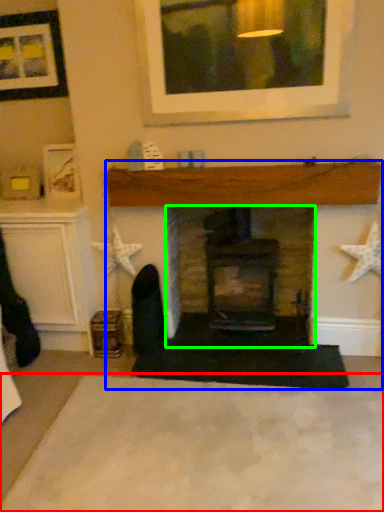
Question: Based on their relative distances, which object is farther from plain (highlighted by a red box)? Choose from fireplace (highlighted by a blue box) and fireplace (highlighted by a green box).

Choices:
 (A) fireplace
 (B) fireplace

Answer: (B)